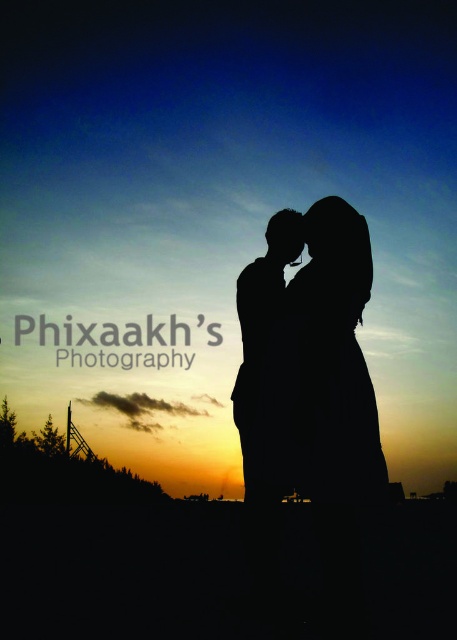
You are a photographer capturing the sunset scene. You notice two silhouettes at the center of the frame. Which one is the silhouette couple at center in relation to the black matte silhouette at center?

The silhouette couple at center is closer to the viewer than the black matte silhouette at center.

You are a photographer trying to capture the perfect shot of the two silhouettes against the sunset. You need to ensure there is enough space between the two figures to avoid them overlapping in the photo. Given that your camera has a minimum focus distance of 12 inches, will the current spacing between the silhouette couple at center and the black matte silhouette at center allow for a clear, non overlapping image?

The distance between the silhouette couple at center and the black matte silhouette at center is 15.02 inches, which is greater than the camera minimum focus distance of 12 inches. Therefore, the current spacing allows for a clear, non overlapping image.

You are a photographer trying to capture the silhouette couple at center in the perfect frame. Given their position at coordinates, can you estimate their location in the image using the grid system where the top left corner is the origin?

The silhouette couple at center is located at coordinates approximately 57.5 percent from the left and 71.1 percent from the top of the image.